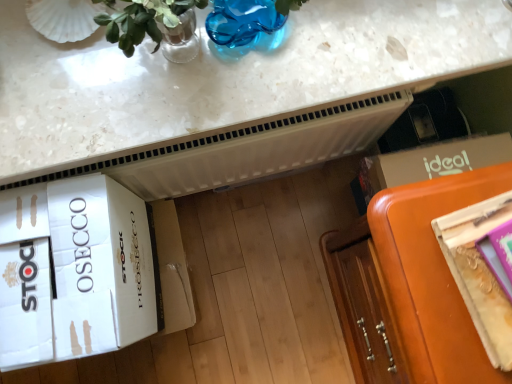
Locate an element on the screen. The width and height of the screenshot is (512, 384). blank area to the left of metallic gold magazine at right is located at coordinates (423, 266).